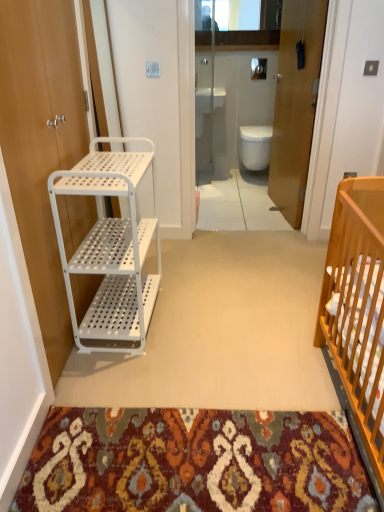
Question: Is transparent glass door at center thinner than white glossy toilet at center?

Choices:
 (A) yes
 (B) no

Answer: (A)

Question: Considering the relative sizes of transparent glass door at center and white glossy toilet at center in the image provided, is transparent glass door at center wider than white glossy toilet at center?

Choices:
 (A) yes
 (B) no

Answer: (B)

Question: Considering the relative sizes of transparent glass door at center and white glossy toilet at center in the image provided, is transparent glass door at center shorter than white glossy toilet at center?

Choices:
 (A) yes
 (B) no

Answer: (B)

Question: Are transparent glass door at center and white glossy toilet at center located far from each other?

Choices:
 (A) no
 (B) yes

Answer: (A)

Question: Can you confirm if transparent glass door at center is taller than white glossy toilet at center?

Choices:
 (A) no
 (B) yes

Answer: (B)

Question: Is transparent glass door at center beside white glossy toilet at center?

Choices:
 (A) no
 (B) yes

Answer: (A)

Question: Is transparent glass door at center facing away from white glossy sink at upper center?

Choices:
 (A) no
 (B) yes

Answer: (B)

Question: From the image's perspective, would you say transparent glass door at center is positioned over white glossy sink at upper center?

Choices:
 (A) yes
 (B) no

Answer: (B)

Question: Is transparent glass door at center at the left side of white glossy sink at upper center?

Choices:
 (A) no
 (B) yes

Answer: (A)

Question: Is transparent glass door at center shorter than white glossy sink at upper center?

Choices:
 (A) no
 (B) yes

Answer: (A)

Question: Considering the relative sizes of transparent glass door at center and white glossy sink at upper center in the image provided, is transparent glass door at center taller than white glossy sink at upper center?

Choices:
 (A) yes
 (B) no

Answer: (A)

Question: Considering the relative positions of transparent glass door at center and white glossy sink at upper center in the image provided, is transparent glass door at center to the right of white glossy sink at upper center from the viewer's perspective?

Choices:
 (A) yes
 (B) no

Answer: (A)

Question: Can you confirm if white glossy sink at upper center is shorter than white matte door at left, the 1th door positioned from the left?

Choices:
 (A) yes
 (B) no

Answer: (A)